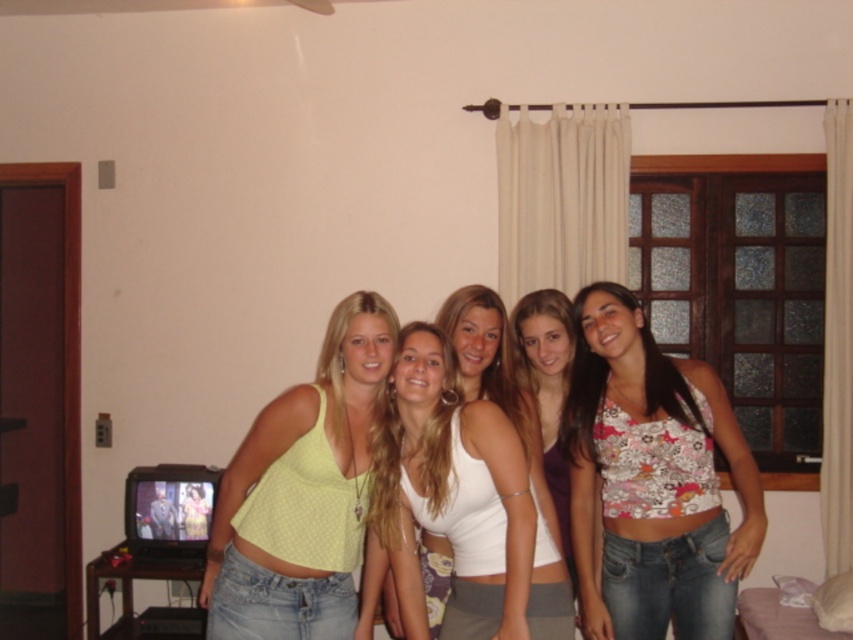
Does floral-patterned fabric top at center have a larger size compared to white matte tank top at center?

Yes, floral-patterned fabric top at center is bigger than white matte tank top at center.

Is point (723, 396) positioned in front of point (495, 492)?

That is False.

Does point (677, 442) come closer to viewer compared to point (422, 323)?

No, (677, 442) is behind (422, 323).

This screenshot has height=640, width=853. I want to click on floral-patterned fabric top at center, so point(653,481).

Is light yellow fabric top at center below white matte tank top at center?

No.

Does light yellow fabric top at center have a greater height compared to white matte tank top at center?

Indeed, light yellow fabric top at center has a greater height compared to white matte tank top at center.

This screenshot has height=640, width=853. Find the location of `light yellow fabric top at center`. light yellow fabric top at center is located at coordinates click(x=302, y=492).

Is floral-patterned fabric top at center to the left of floral fabric top at center from the viewer's perspective?

Incorrect, floral-patterned fabric top at center is not on the left side of floral fabric top at center.

Is floral-patterned fabric top at center shorter than floral fabric top at center?

No, floral-patterned fabric top at center is not shorter than floral fabric top at center.

The width and height of the screenshot is (853, 640). Identify the location of floral-patterned fabric top at center. (653, 481).